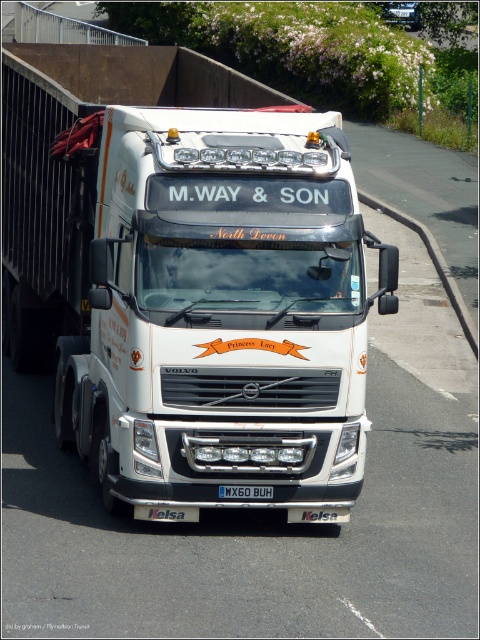
Question: Can you confirm if white glossy truck at center is positioned below black plastic license plate at center?

Choices:
 (A) no
 (B) yes

Answer: (A)

Question: Which point is closer to the camera taking this photo?

Choices:
 (A) (254, 460)
 (B) (243, 492)

Answer: (A)

Question: Which point is farther to the camera?

Choices:
 (A) white glossy truck at center
 (B) black plastic license plate at center

Answer: (B)

Question: Is white glossy truck at center wider than black plastic license plate at center?

Choices:
 (A) yes
 (B) no

Answer: (A)

Question: From the image, what is the correct spatial relationship of white glossy truck at center in relation to black plastic license plate at center?

Choices:
 (A) left
 (B) right

Answer: (A)